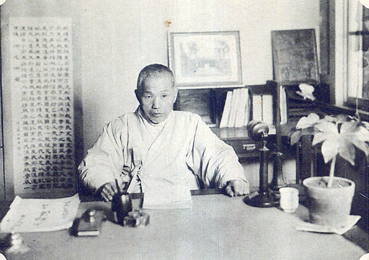
The image size is (369, 260). What are the coordinates of `paper on desk` in the screenshot? It's located at (50, 214).